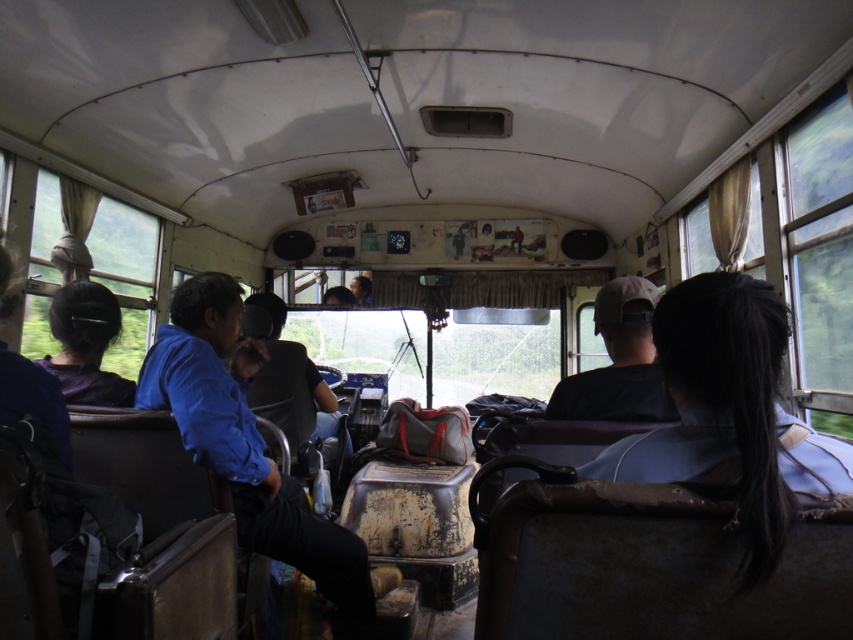
Does blue fabric shirt at left have a greater width compared to dark gray fabric cap at center?

Yes, blue fabric shirt at left is wider than dark gray fabric cap at center.

Locate an element on the screen. This screenshot has width=853, height=640. blue fabric shirt at left is located at coordinates (244, 440).

What do you see at coordinates (244, 440) in the screenshot? This screenshot has width=853, height=640. I see `blue fabric shirt at left` at bounding box center [244, 440].

Where is `blue fabric shirt at left`? blue fabric shirt at left is located at coordinates (244, 440).

Does dark gray fabric cap at center appear on the right side of black hair at left?

Indeed, dark gray fabric cap at center is positioned on the right side of black hair at left.

From the picture: Is dark gray fabric cap at center to the left of black hair at left from the viewer's perspective?

No, dark gray fabric cap at center is not to the left of black hair at left.

Who is more distant from viewer, (628, 301) or (78, 384)?

The point (78, 384) is behind.

Where is `dark gray fabric cap at center`? The image size is (853, 640). dark gray fabric cap at center is located at coordinates (618, 362).

Who is more distant from viewer, (247, 449) or (111, 321)?

Point (111, 321)

Can you confirm if blue fabric shirt at left is positioned above black hair at left?

Incorrect, blue fabric shirt at left is not positioned above black hair at left.

Who is more forward, (x=239, y=449) or (x=61, y=292)?

Point (x=239, y=449)

Locate an element on the screen. Image resolution: width=853 pixels, height=640 pixels. blue fabric shirt at left is located at coordinates (244, 440).